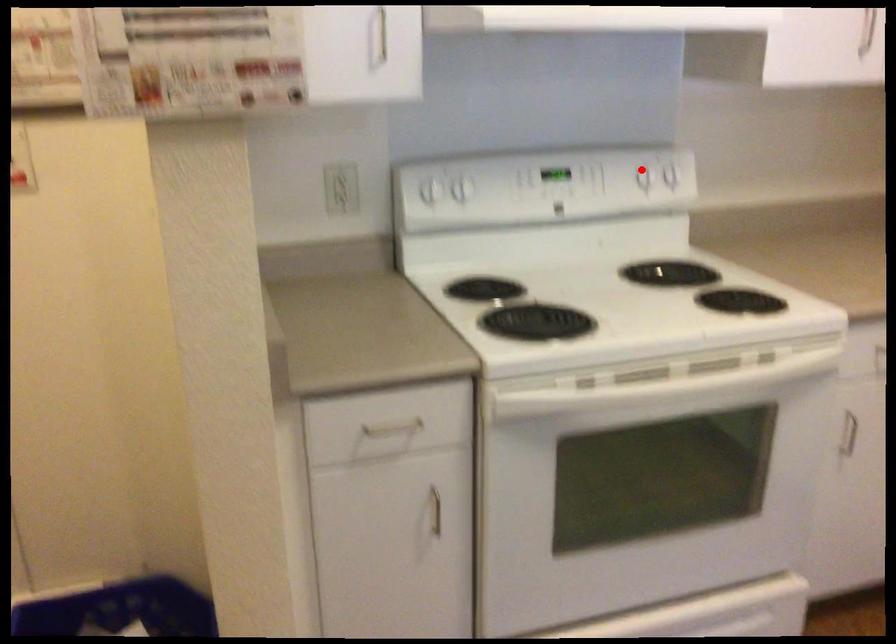
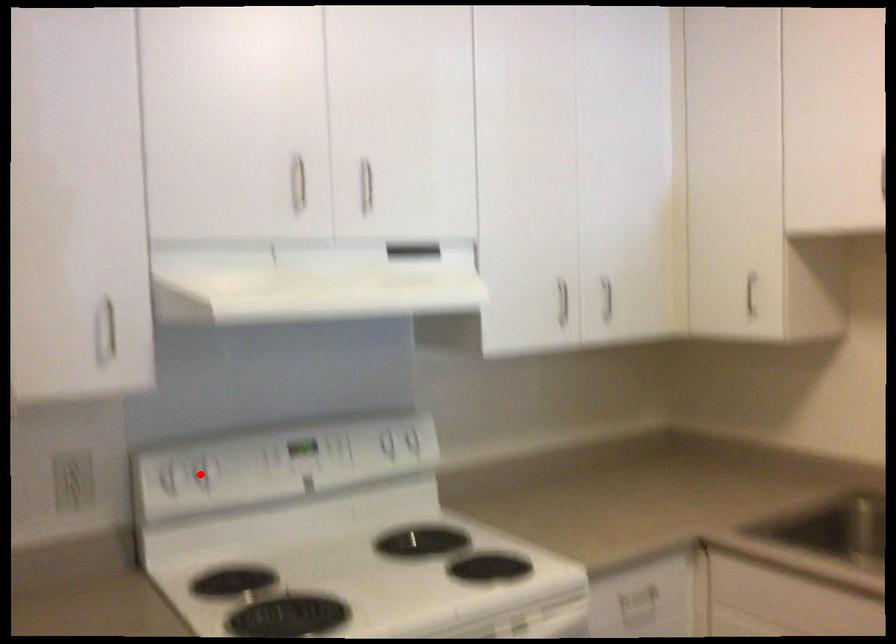
I am providing you with two images of the same scene from different viewpoints. A red point is marked on the first image and another point is marked on the second image. Does the point marked in image1 correspond to the same location as the one in image2?

No